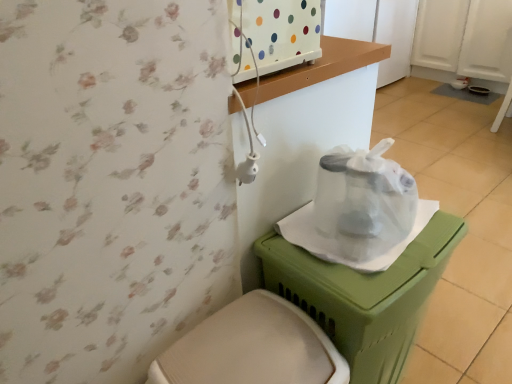
Question: Considering the relative positions of transparent plastic bag at center and green plastic potty at lower right in the image provided, is transparent plastic bag at center behind green plastic potty at lower right?

Choices:
 (A) yes
 (B) no

Answer: (A)

Question: Is transparent plastic bag at center not within green plastic potty at lower right?

Choices:
 (A) yes
 (B) no

Answer: (B)

Question: Is transparent plastic bag at center at the right side of green plastic potty at lower right?

Choices:
 (A) no
 (B) yes

Answer: (A)

Question: Is transparent plastic bag at center bigger than green plastic potty at lower right?

Choices:
 (A) yes
 (B) no

Answer: (B)

Question: From the image's perspective, is transparent plastic bag at center beneath green plastic potty at lower right?

Choices:
 (A) yes
 (B) no

Answer: (B)

Question: Does transparent plastic bag at center appear on the left side of green plastic potty at lower right?

Choices:
 (A) no
 (B) yes

Answer: (B)

Question: Does transparent plastic bag at center have a greater width compared to white plastic toilet at lower center?

Choices:
 (A) no
 (B) yes

Answer: (A)

Question: Does transparent plastic bag at center have a larger size compared to white plastic toilet at lower center?

Choices:
 (A) yes
 (B) no

Answer: (B)

Question: Is the depth of transparent plastic bag at center greater than that of white plastic toilet at lower center?

Choices:
 (A) no
 (B) yes

Answer: (B)

Question: Is transparent plastic bag at center turned away from white plastic toilet at lower center?

Choices:
 (A) yes
 (B) no

Answer: (B)

Question: Is transparent plastic bag at center facing towards white plastic toilet at lower center?

Choices:
 (A) no
 (B) yes

Answer: (A)

Question: Is transparent plastic bag at center outside white plastic toilet at lower center?

Choices:
 (A) yes
 (B) no

Answer: (A)

Question: Considering the relative positions of white plastic toilet at lower center and transparent plastic bag at center in the image provided, is white plastic toilet at lower center to the left of transparent plastic bag at center from the viewer's perspective?

Choices:
 (A) yes
 (B) no

Answer: (A)